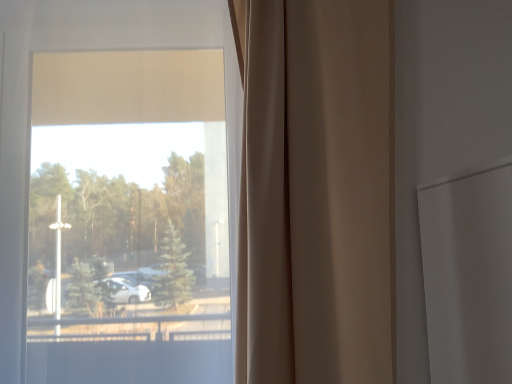
Image resolution: width=512 pixels, height=384 pixels. Describe the element at coordinates (30, 101) in the screenshot. I see `transparent glass window at center` at that location.

Where is `transparent glass window at center`? transparent glass window at center is located at coordinates (30, 101).

The width and height of the screenshot is (512, 384). I want to click on beige fabric curtain at center, so click(316, 192).

Describe the element at coordinates (316, 192) in the screenshot. I see `beige fabric curtain at center` at that location.

The width and height of the screenshot is (512, 384). What are the coordinates of `transparent glass window at center` in the screenshot? It's located at (30, 101).

Considering the relative positions of transparent glass window at center and beige fabric curtain at center in the image provided, is transparent glass window at center to the right of beige fabric curtain at center from the viewer's perspective?

No.

Who is more distant, transparent glass window at center or beige fabric curtain at center?

transparent glass window at center is further away from the camera.

Is point (22, 238) positioned before point (248, 349)?

No, (22, 238) is further to viewer.

Consider the image. From the image's perspective, which one is positioned lower, transparent glass window at center or beige fabric curtain at center?

beige fabric curtain at center, from the image's perspective.

From a real-world perspective, is transparent glass window at center physically located above or below beige fabric curtain at center?

transparent glass window at center is situated higher than beige fabric curtain at center in the real world.

Considering the sizes of objects transparent glass window at center and beige fabric curtain at center in the image provided, who is wider, transparent glass window at center or beige fabric curtain at center?

Wider between the two is transparent glass window at center.

Is transparent glass window at center taller than beige fabric curtain at center?

Result: Correct, transparent glass window at center is much taller as beige fabric curtain at center.

Between transparent glass window at center and beige fabric curtain at center, which one has smaller size?

With smaller size is beige fabric curtain at center.

Is transparent glass window at center positioned beyond the bounds of beige fabric curtain at center?

Indeed, transparent glass window at center is completely outside beige fabric curtain at center.

Is transparent glass window at center positioned far away from beige fabric curtain at center?

No, transparent glass window at center is in close proximity to beige fabric curtain at center.

Could you tell me if transparent glass window at center is facing beige fabric curtain at center?

No, transparent glass window at center is not turned towards beige fabric curtain at center.

How different are the orientations of transparent glass window at center and beige fabric curtain at center in degrees?

transparent glass window at center and beige fabric curtain at center are facing 3.1e-05 degrees away from each other.

The image size is (512, 384). Identify the location of curtain below the transparent glass window at center (from the image's perspective). (316, 192).

Between beige fabric curtain at center and transparent glass window at center, which one appears on the right side from the viewer's perspective?

beige fabric curtain at center is more to the right.

Which object is more forward, beige fabric curtain at center or transparent glass window at center?

beige fabric curtain at center is closer to the camera.

Considering the positions of point (350, 102) and point (177, 41), is point (350, 102) closer or farther from the camera than point (177, 41)?

Point (350, 102) is closer to the camera than point (177, 41).

Looking at this image, from the image's perspective, which object appears higher, beige fabric curtain at center or transparent glass window at center?

transparent glass window at center.

From a real-world perspective, is beige fabric curtain at center positioned under transparent glass window at center based on gravity?

Yes, from a real-world perspective, beige fabric curtain at center is under transparent glass window at center.

Does beige fabric curtain at center have a greater width compared to transparent glass window at center?

No.

Which of these two, beige fabric curtain at center or transparent glass window at center, stands shorter?

With less height is beige fabric curtain at center.

Is beige fabric curtain at center smaller than transparent glass window at center?

Indeed, beige fabric curtain at center has a smaller size compared to transparent glass window at center.

Is beige fabric curtain at center not inside transparent glass window at center?

Absolutely, beige fabric curtain at center is external to transparent glass window at center.

Is beige fabric curtain at center in contact with transparent glass window at center?

There is a gap between beige fabric curtain at center and transparent glass window at center.

Is beige fabric curtain at center facing away from transparent glass window at center?

No, beige fabric curtain at center's orientation is not away from transparent glass window at center.

What's the angular difference between beige fabric curtain at center and transparent glass window at center's facing directions?

The facing directions of beige fabric curtain at center and transparent glass window at center are 3.1e-05 degrees apart.

Locate an element on the screen. Image resolution: width=512 pixels, height=384 pixels. window that appears on the left of beige fabric curtain at center is located at coordinates (30, 101).

At what (x,y) coordinates should I click in order to perform the action: click on curtain on the right of transparent glass window at center. Please return your answer as a coordinate pair (x, y). Looking at the image, I should click on (316, 192).

The height and width of the screenshot is (384, 512). In the image, there is a transparent glass window at center. In order to click on curtain below it (from the image's perspective) in this screenshot , I will do `click(316, 192)`.